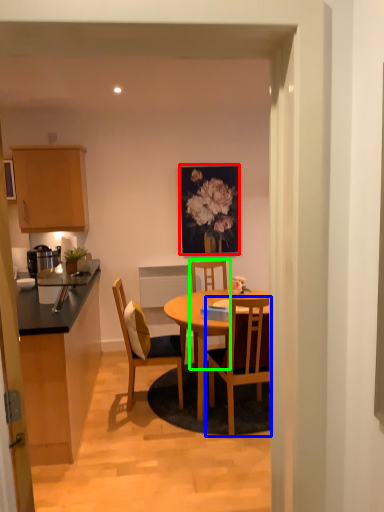
Question: Based on their relative distances, which object is nearer to picture frame (highlighted by a red box)? Choose from chair (highlighted by a blue box) and chair (highlighted by a green box).

Choices:
 (A) chair
 (B) chair

Answer: (B)